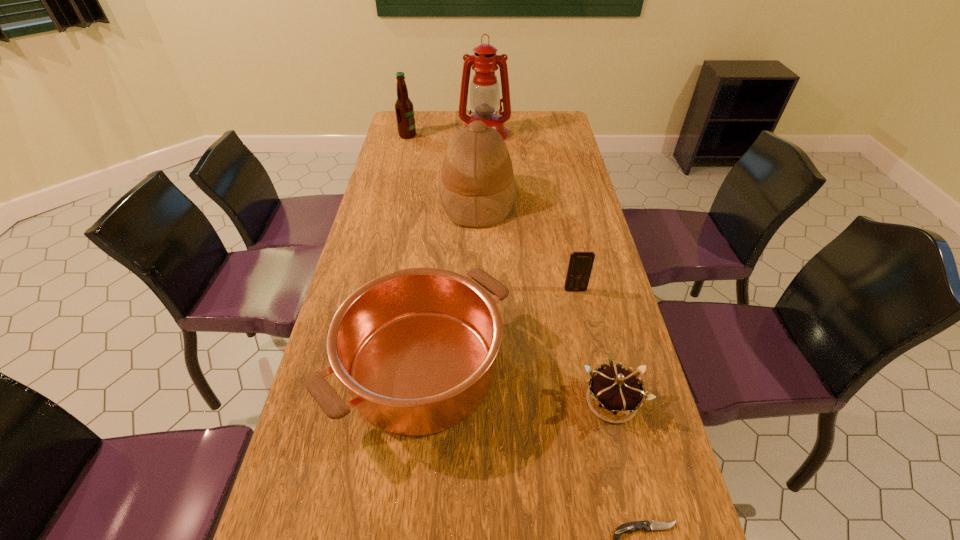
In order to click on oil lamp in this screenshot , I will do `click(485, 99)`.

Identify the location of hat. This screenshot has width=960, height=540. pos(477,188).

The image size is (960, 540). Find the location of `beer bottle`. beer bottle is located at coordinates (404, 110).

The width and height of the screenshot is (960, 540). Identify the location of saucepan. (415, 347).

Where is `cellular telephone`? cellular telephone is located at coordinates (580, 265).

The width and height of the screenshot is (960, 540). I want to click on the second shortest object, so click(614, 394).

This screenshot has width=960, height=540. What are the coordinates of `vacant space located 0.160m on the left of the tallest object` in the screenshot? It's located at (421, 133).

Locate an element on the screen. The width and height of the screenshot is (960, 540). vacant point located 0.120m on the front-facing side of the fifth nearest object is located at coordinates (550, 199).

The height and width of the screenshot is (540, 960). Find the location of `vacant space situated 0.290m on the label of the beer bottle`. vacant space situated 0.290m on the label of the beer bottle is located at coordinates (486, 136).

The width and height of the screenshot is (960, 540). I want to click on vacant space positioned 0.120m on the back of the saucepan, so tap(432, 274).